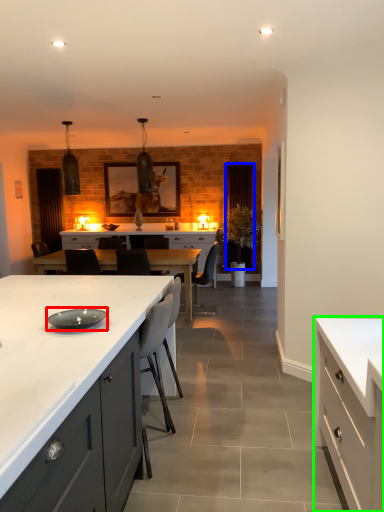
Question: Which object is the closest to the plate (highlighted by a red box)? Choose among these: glass door (highlighted by a blue box) or cabinetry (highlighted by a green box).

Choices:
 (A) glass door
 (B) cabinetry

Answer: (B)